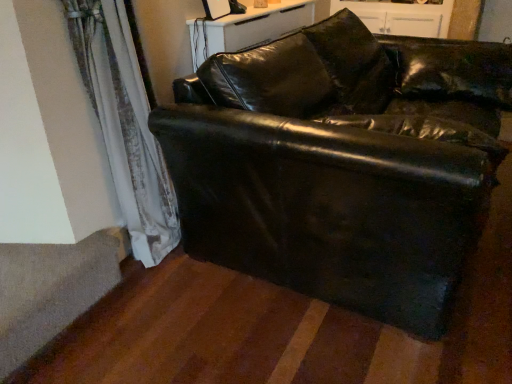
Question: Would you say black leather couch at center is a long distance from white glossy dresser at upper center?

Choices:
 (A) yes
 (B) no

Answer: (A)

Question: Is black leather couch at center thinner than white glossy dresser at upper center?

Choices:
 (A) yes
 (B) no

Answer: (B)

Question: Considering the relative sizes of black leather couch at center and white glossy dresser at upper center in the image provided, is black leather couch at center wider than white glossy dresser at upper center?

Choices:
 (A) no
 (B) yes

Answer: (B)

Question: From a real-world perspective, is black leather couch at center physically above white glossy dresser at upper center?

Choices:
 (A) yes
 (B) no

Answer: (B)

Question: Is black leather couch at center surrounding white glossy dresser at upper center?

Choices:
 (A) no
 (B) yes

Answer: (A)

Question: Is point (448, 19) closer or farther from the camera than point (110, 258)?

Choices:
 (A) farther
 (B) closer

Answer: (A)

Question: Considering the positions of white glossy dresser at upper center and gray carpet at lower left in the image, is white glossy dresser at upper center wider or thinner than gray carpet at lower left?

Choices:
 (A) wide
 (B) thin

Answer: (A)

Question: From a real-world perspective, is white glossy dresser at upper center positioned above or below gray carpet at lower left?

Choices:
 (A) above
 (B) below

Answer: (A)

Question: Is white glossy dresser at upper center inside the boundaries of gray carpet at lower left, or outside?

Choices:
 (A) inside
 (B) outside

Answer: (B)

Question: Relative to gray carpet at lower left, is satin white curtain at lower left in front or behind?

Choices:
 (A) front
 (B) behind

Answer: (A)

Question: Does point (178, 220) appear closer or farther from the camera than point (121, 228)?

Choices:
 (A) closer
 (B) farther

Answer: (A)

Question: In terms of height, does satin white curtain at lower left look taller or shorter compared to gray carpet at lower left?

Choices:
 (A) tall
 (B) short

Answer: (A)

Question: From the image's perspective, is satin white curtain at lower left above or below gray carpet at lower left?

Choices:
 (A) above
 (B) below

Answer: (A)

Question: Do you think white glossy dresser at upper center is within black leather couch at center, or outside of it?

Choices:
 (A) inside
 (B) outside

Answer: (B)

Question: Is point (408, 26) closer or farther from the camera than point (224, 180)?

Choices:
 (A) closer
 (B) farther

Answer: (B)